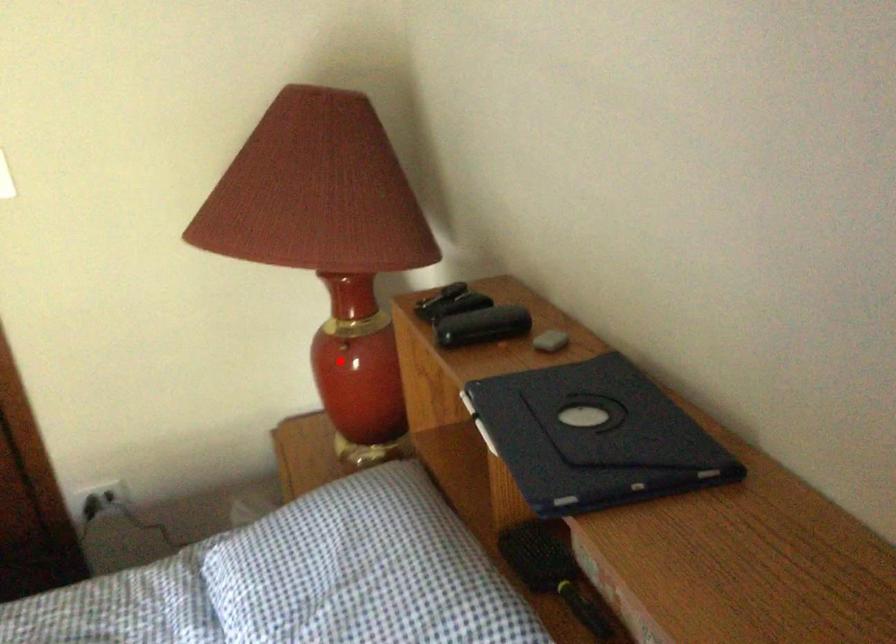
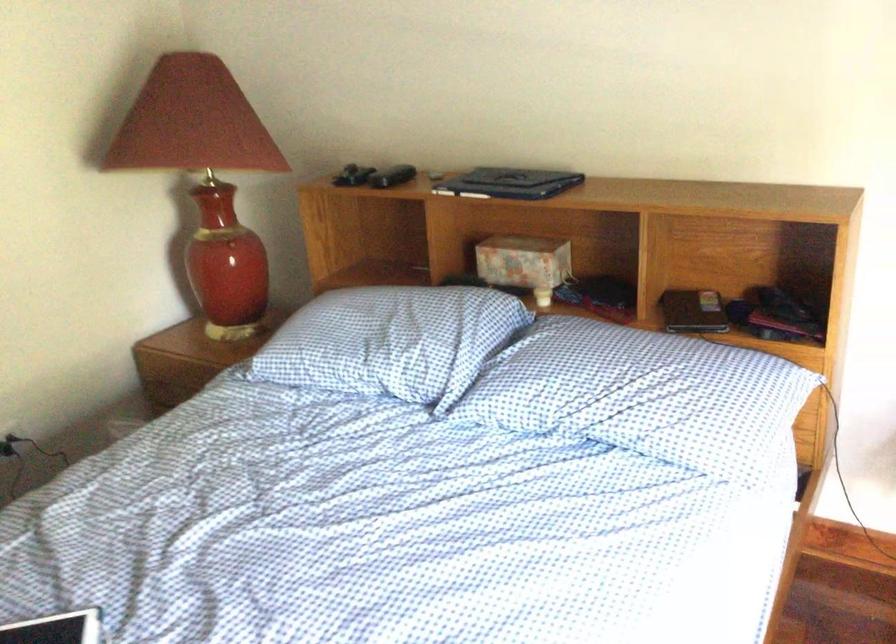
The point at the highlighted location is marked in the first image. Where is the corresponding point in the second image?

(229, 249)